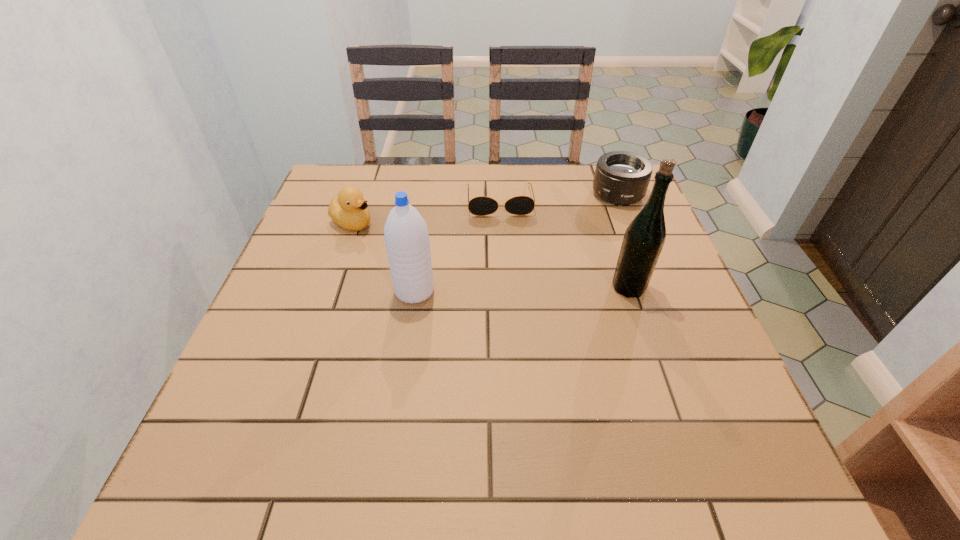
Identify the location of vacant area that lies between the telephoto lens and the water bottle. (516, 243).

Identify the location of vacant region between the beer bottle and the leftmost object. Image resolution: width=960 pixels, height=540 pixels. (491, 255).

Image resolution: width=960 pixels, height=540 pixels. Find the location of `free space that is in between the leftmost object and the beer bottle`. free space that is in between the leftmost object and the beer bottle is located at coordinates (491, 255).

The image size is (960, 540). Find the location of `empty space between the duckling and the water bottle`. empty space between the duckling and the water bottle is located at coordinates (384, 257).

I want to click on free spot between the third object from left to right and the fourth shortest object, so click(457, 246).

You are a GUI agent. You are given a task and a screenshot of the screen. Output one action in this format:
    pyautogui.click(x=<x>, y=<y>)
    Task: Click on the free spot between the fourth shortest object and the leftmost object
    The height and width of the screenshot is (540, 960).
    Given the screenshot: What is the action you would take?
    pyautogui.click(x=384, y=257)

Locate which object is the third closest to the beer bottle. Please provide its 2D coordinates. Your answer should be formatted as a tuple, i.e. [(x, y)], where the tuple contains the x and y coordinates of a point satisfying the conditions above.

[(406, 235)]

This screenshot has height=540, width=960. I want to click on the third closest object to the tallest object, so click(406, 235).

Where is `vacant space that satisfies the following two spatial constraints: 1. on the back side of the second tallest object; 2. on the right side of the shortest object`? This screenshot has width=960, height=540. vacant space that satisfies the following two spatial constraints: 1. on the back side of the second tallest object; 2. on the right side of the shortest object is located at coordinates (428, 200).

Locate an element on the screen. The image size is (960, 540). blank space that satisfies the following two spatial constraints: 1. on the back side of the duckling; 2. on the right side of the third object from right to left is located at coordinates (360, 200).